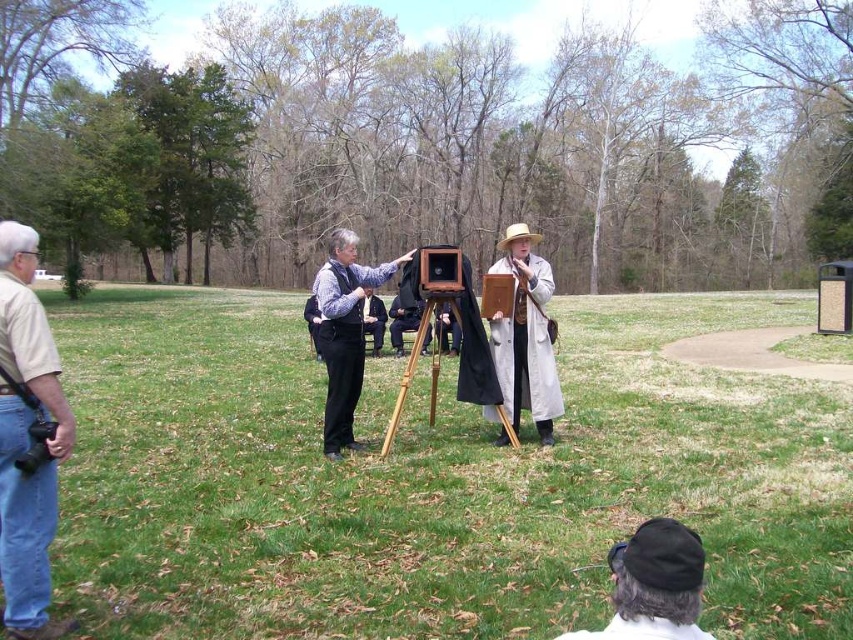
Question: Estimate the real-world distances between objects in this image. Which object is farther from the wooden tripod at center?

Choices:
 (A) light beige fabric coat at center
 (B) matte black camera at center
 (C) dark gray wool hat at lower center

Answer: (C)

Question: In this image, where is matte wooden tripod at center located relative to matte black camera at left?

Choices:
 (A) below
 (B) above

Answer: (B)

Question: Is matte wooden tripod at center behind matte black camera at left?

Choices:
 (A) yes
 (B) no

Answer: (A)

Question: Can you confirm if dark gray wool hat at lower center is thinner than matte black camera at center?

Choices:
 (A) no
 (B) yes

Answer: (A)

Question: Among these points, which one is farthest from the camera?

Choices:
 (A) (32, 316)
 (B) (227, 627)
 (C) (393, 260)

Answer: (C)

Question: Which object is positioned closest to the wooden tripod at center?

Choices:
 (A) matte wooden tripod at center
 (B) dark gray wool hat at lower center

Answer: (A)